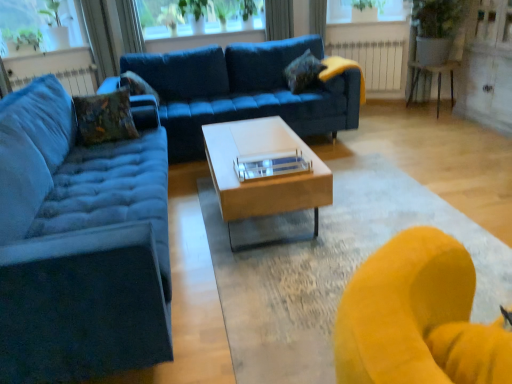
Question: From a real-world perspective, is velvet textured pillow at upper center, the 1th pillow from the right, physically below velvet textured pillow at upper left, the second pillow viewed from the back?

Choices:
 (A) yes
 (B) no

Answer: (B)

Question: Is velvet textured pillow at upper center, the 1th pillow from the right, further to the viewer compared to velvet textured pillow at upper left, the second pillow when ordered from left to right?

Choices:
 (A) no
 (B) yes

Answer: (B)

Question: Is velvet textured pillow at upper center, positioned as the third pillow in left-to-right order, positioned in front of velvet textured pillow at upper left, which is counted as the 2th pillow, starting from the right?

Choices:
 (A) no
 (B) yes

Answer: (A)

Question: Can you confirm if velvet textured pillow at upper center, the 1th pillow from the right, is taller than velvet textured pillow at upper left, which is counted as the 2th pillow, starting from the right?

Choices:
 (A) no
 (B) yes

Answer: (A)

Question: Is velvet textured pillow at upper left, which is counted as the 2th pillow, starting from the right, at the back of velvet textured pillow at upper center, the third pillow in the front-to-back sequence?

Choices:
 (A) yes
 (B) no

Answer: (B)

Question: From the image's perspective, is velvet textured pillow at upper center, positioned as the third pillow in left-to-right order, located above velvet textured pillow at upper left, which is the second pillow from front to back?

Choices:
 (A) no
 (B) yes

Answer: (B)

Question: Is green leafy plant at upper left at the left side of transparent glass window screen at upper left, marked as the second window screen in a right-to-left arrangement?

Choices:
 (A) yes
 (B) no

Answer: (A)

Question: Would you say green leafy plant at upper left is outside transparent glass window screen at upper left, which is the first window screen in left-to-right order?

Choices:
 (A) yes
 (B) no

Answer: (A)

Question: Is green leafy plant at upper left directly adjacent to transparent glass window screen at upper left, which is the first window screen in left-to-right order?

Choices:
 (A) yes
 (B) no

Answer: (B)

Question: Is green leafy plant at upper left in front of transparent glass window screen at upper left, marked as the second window screen in a right-to-left arrangement?

Choices:
 (A) yes
 (B) no

Answer: (A)

Question: Can you confirm if green leafy plant at upper left is smaller than transparent glass window screen at upper left, marked as the second window screen in a right-to-left arrangement?

Choices:
 (A) yes
 (B) no

Answer: (A)

Question: Can you confirm if green leafy plant at upper left is wider than transparent glass window screen at upper left, marked as the second window screen in a right-to-left arrangement?

Choices:
 (A) no
 (B) yes

Answer: (A)

Question: Is velvet textured pillow at upper center, which appears as the first pillow when viewed from the back, located outside velvet blue couch at left, which is counted as the 2th studio couch, starting from the back?

Choices:
 (A) no
 (B) yes

Answer: (B)